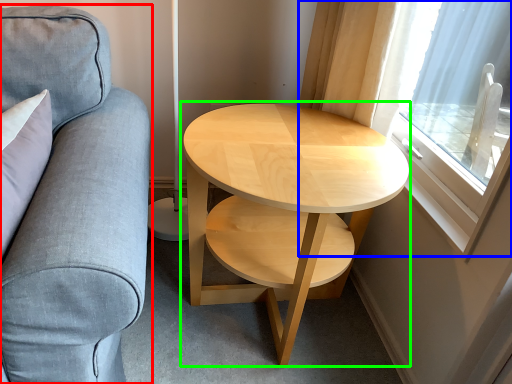
Question: Which object is the closest to the studio couch (highlighted by a red box)? Choose among these: window (highlighted by a blue box) or coffee table (highlighted by a green box).

Choices:
 (A) window
 (B) coffee table

Answer: (B)